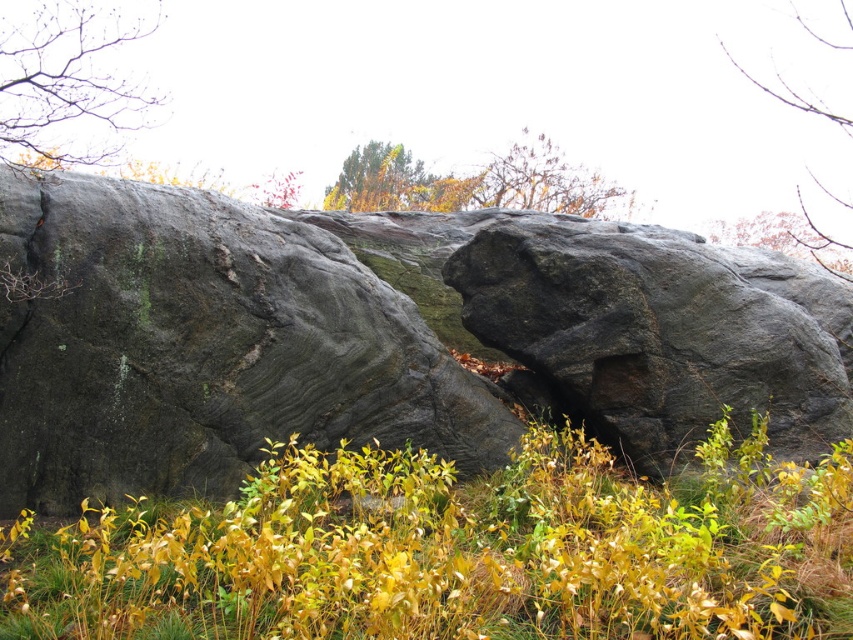
Question: Which point is farther to the camera?

Choices:
 (A) (337, 195)
 (B) (671, 333)

Answer: (A)

Question: Is rough gray rock at center to the left of bare branches at upper left from the viewer's perspective?

Choices:
 (A) yes
 (B) no

Answer: (B)

Question: Considering the real-world distances, which object is farthest from the yellow-green grass at center?

Choices:
 (A) dark gray stone boulder at center
 (B) brown wood tree at upper right

Answer: (B)

Question: Can you confirm if dark gray stone boulder at center is wider than green leafy tree at upper center?

Choices:
 (A) yes
 (B) no

Answer: (A)

Question: Which object is positioned farthest from the rough gray rock at center?

Choices:
 (A) dark gray stone boulder at center
 (B) brown textured tree at upper center
 (C) bare branches at upper left

Answer: (B)

Question: In this image, where is yellow-green grass at center located relative to bare branches at upper left?

Choices:
 (A) above
 (B) below

Answer: (B)